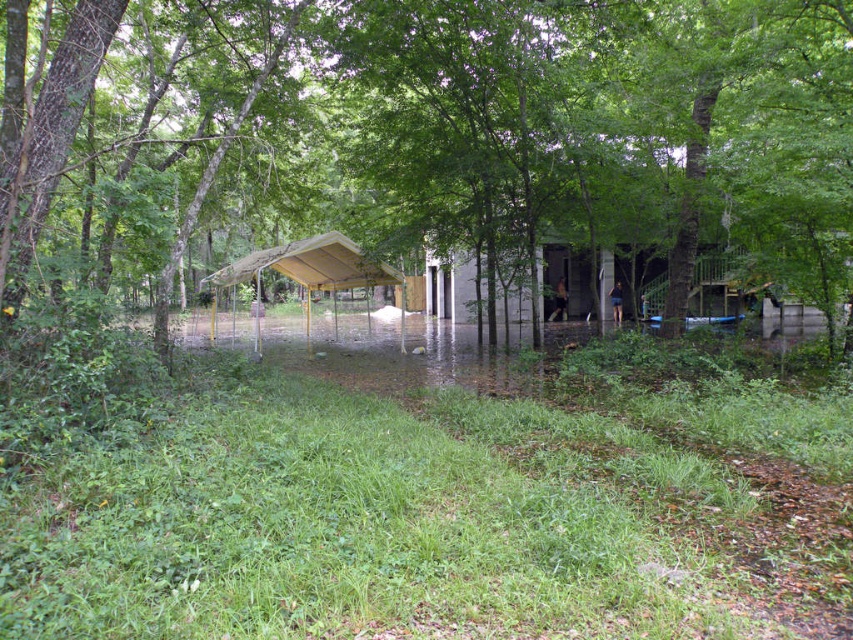
Question: Is brown wood tree at center to the left of yellow metal carport at center from the viewer's perspective?

Choices:
 (A) yes
 (B) no

Answer: (B)

Question: In this image, where is brown wood tree at center located relative to yellow metal carport at center?

Choices:
 (A) left
 (B) right

Answer: (B)

Question: Which object is farther from the camera taking this photo?

Choices:
 (A) yellow metal carport at center
 (B) brown wood tree at center

Answer: (A)

Question: In this image, where is brown wood tree at center located relative to yellow metal carport at center?

Choices:
 (A) right
 (B) left

Answer: (A)

Question: Which point is closer to the camera taking this photo?

Choices:
 (A) (346, 244)
 (B) (12, 10)

Answer: (B)